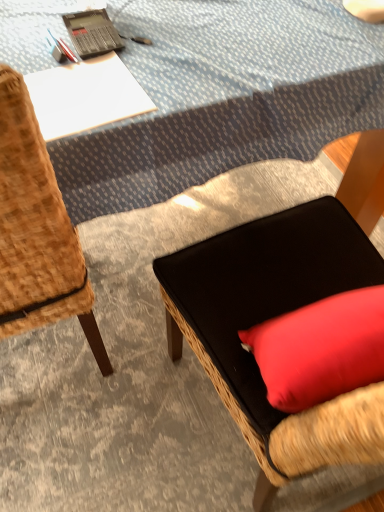
Identify the location of free point below white paper at upper left (from a real-world perspective). (81, 97).